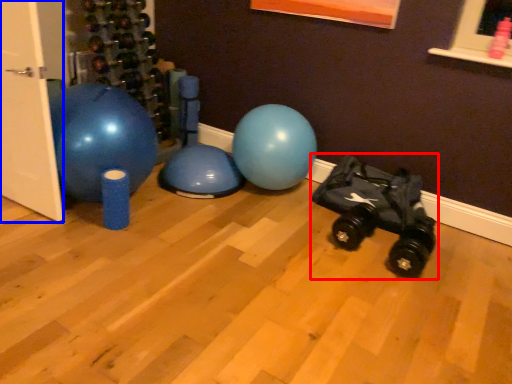
Question: Which object appears farthest to the camera in this image, baby carriage (highlighted by a red box) or door (highlighted by a blue box)?

Choices:
 (A) baby carriage
 (B) door

Answer: (A)